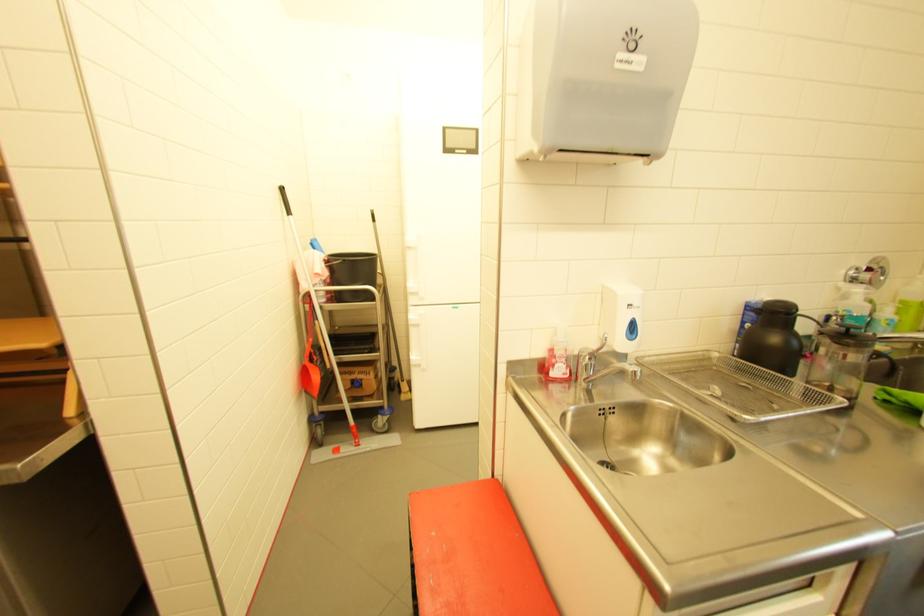
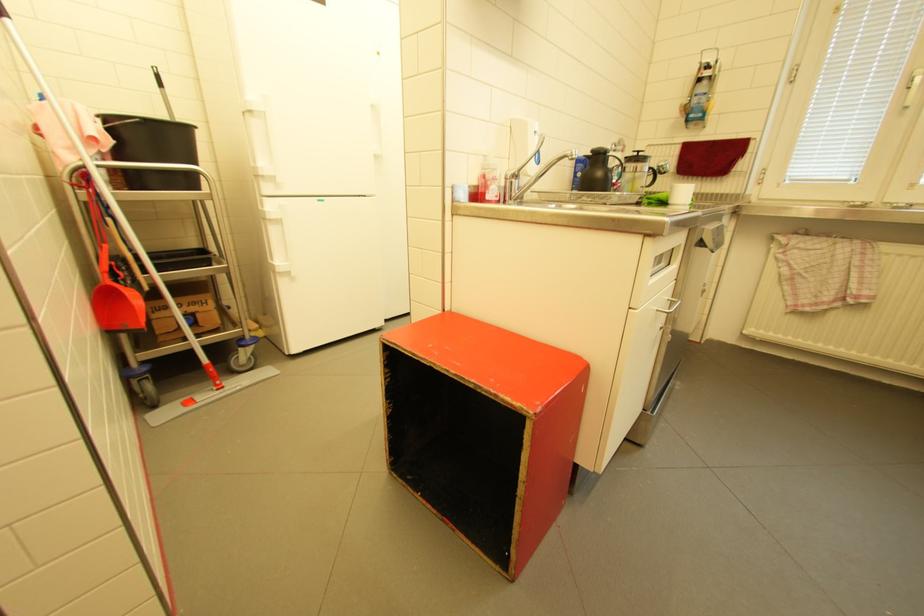
Question: The camera is either moving clockwise (left) or counter-clockwise (right) around the object. The first image is from the beginning of the video and the second image is from the end. Is the camera moving left or right when shooting the video?

Choices:
 (A) Left
 (B) Right

Answer: (A)